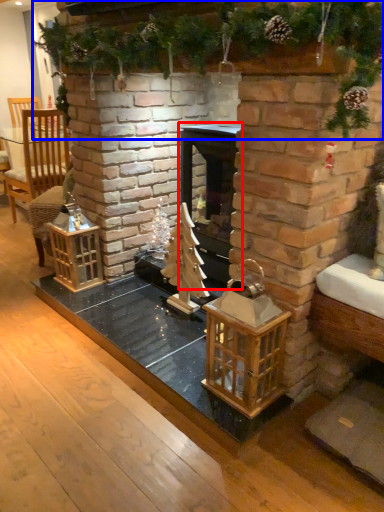
Question: Which object appears closest to the camera in this image, fireplace (highlighted by a red box) or christmas decoration (highlighted by a blue box)?

Choices:
 (A) fireplace
 (B) christmas decoration

Answer: (B)